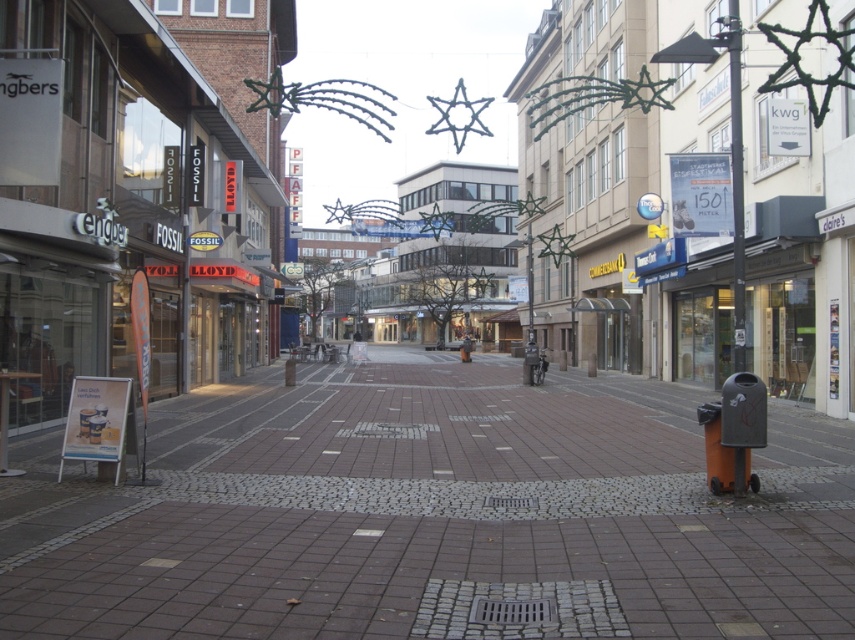
You are a delivery person trying to find the entrance to the Pfaff store. You see the brick paved street at center and the matte black trash can at lower right. Which object is closer to the right side of the image?

The brick paved street at center is to the right of matte black trash can at lower right, so the brick paved street at center is closer to the right side of the image.

You are standing on the brick paved street at center and want to throw away a piece of trash. You see the matte black trash can at lower right. Is the trash can closer to you or farther away?

The brick paved street at center is closer to the viewer than the matte black trash can at lower right, so the trash can is farther away from you.

You are a delivery drone operator. Your drone needs to land on the brick paved street at center. The drone has a minimum safe landing distance of 5 meters from the operator. Are you able to land the drone safely while maintaining the required distance?

The distance between the brick paved street at center and the camera is 4.55 meters. Since the drone requires a minimum safe landing distance of 5 meters, the current distance is insufficient. You cannot land the drone safely while maintaining the required distance.